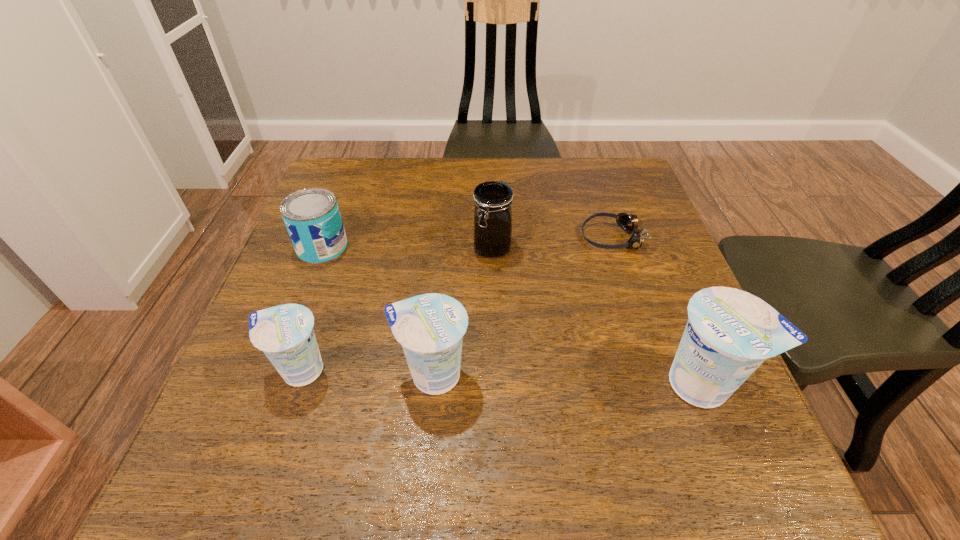
To achieve uniform spacing by inserting another yogurt among them, please point to a free space for this new yogurt. Please provide its 2D coordinates. Your answer should be formatted as a tuple, i.e. [(x, y)], where the tuple contains the x and y coordinates of a point satisfying the conditions above.

[(566, 379)]